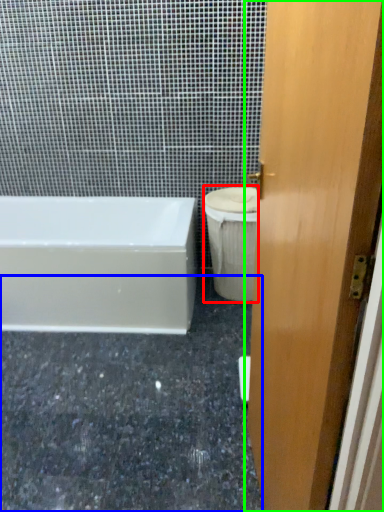
Question: Which is nearer to the toilet bowl (highlighted by a red box)? granite (highlighted by a blue box) or door (highlighted by a green box).

Choices:
 (A) granite
 (B) door

Answer: (A)